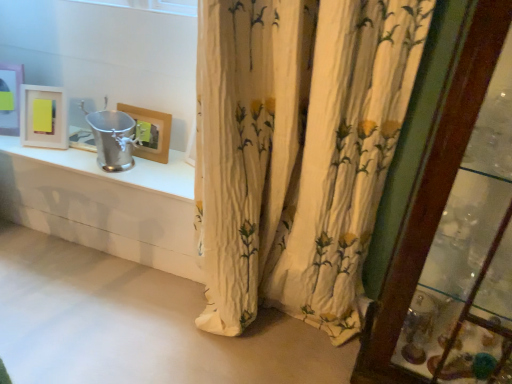
Question: Is matte white picture frame at upper left, which is counted as the 2th picture frame, starting from the right, taller or shorter than white floral fabric curtain at center?

Choices:
 (A) tall
 (B) short

Answer: (B)

Question: In terms of size, does matte white picture frame at upper left, the second picture frame positioned from the left, appear bigger or smaller than white floral fabric curtain at center?

Choices:
 (A) small
 (B) big

Answer: (A)

Question: Estimate the real-world distances between objects in this image. Which object is closer to the matte white picture frame at upper left, which ranks as the 1th picture frame in left-to-right order?

Choices:
 (A) white floral fabric curtain at center
 (B) matte wooden picture frame at upper center, marked as the third picture frame in a left-to-right arrangement
 (C) wooden glass door at right
 (D) matte white picture frame at upper left, which is counted as the 2th picture frame, starting from the right

Answer: (D)

Question: Based on their relative distances, which object is nearer to the matte white picture frame at upper left, which is counted as the 2th picture frame, starting from the right?

Choices:
 (A) matte white picture frame at upper left, which is counted as the third picture frame, starting from the right
 (B) matte wooden picture frame at upper center, the first picture frame in the right-to-left sequence
 (C) white floral fabric curtain at center
 (D) wooden glass door at right

Answer: (A)